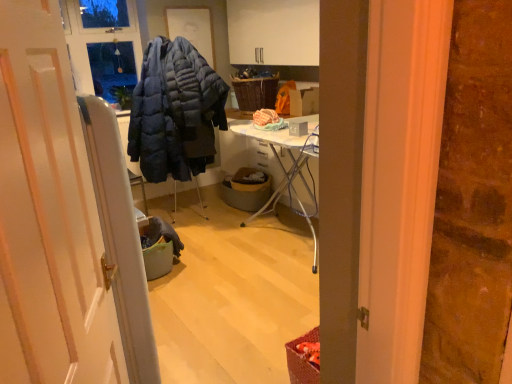
Question: Does white glossy door at center have a greater height compared to woven brown picnic basket at center?

Choices:
 (A) yes
 (B) no

Answer: (A)

Question: Does white glossy door at center appear on the right side of woven brown picnic basket at center?

Choices:
 (A) no
 (B) yes

Answer: (A)

Question: Is white glossy door at center thinner than woven brown picnic basket at center?

Choices:
 (A) yes
 (B) no

Answer: (A)

Question: Does white glossy door at center have a greater width compared to woven brown picnic basket at center?

Choices:
 (A) yes
 (B) no

Answer: (B)

Question: Considering the relative sizes of white glossy door at center and woven brown picnic basket at center in the image provided, is white glossy door at center smaller than woven brown picnic basket at center?

Choices:
 (A) yes
 (B) no

Answer: (B)

Question: From the image's perspective, is white glossy door at center positioned above or below woven brown picnic basket at center?

Choices:
 (A) above
 (B) below

Answer: (B)

Question: In the image, is white glossy door at center on the left side or the right side of woven brown picnic basket at center?

Choices:
 (A) left
 (B) right

Answer: (A)

Question: Is white glossy door at center taller or shorter than woven brown picnic basket at center?

Choices:
 (A) short
 (B) tall

Answer: (B)

Question: Is white glossy door at center inside the boundaries of woven brown picnic basket at center, or outside?

Choices:
 (A) outside
 (B) inside

Answer: (A)

Question: From a real-world perspective, is brown woven basket at center above or below woven brown picnic basket at center?

Choices:
 (A) below
 (B) above

Answer: (A)

Question: Based on their positions, is brown woven basket at center located to the left or right of woven brown picnic basket at center?

Choices:
 (A) right
 (B) left

Answer: (B)

Question: Choose the correct answer: Is brown woven basket at center inside woven brown picnic basket at center or outside it?

Choices:
 (A) inside
 (B) outside

Answer: (B)

Question: Considering the positions of brown woven basket at center and woven brown picnic basket at center in the image, is brown woven basket at center bigger or smaller than woven brown picnic basket at center?

Choices:
 (A) small
 (B) big

Answer: (A)

Question: From the image's perspective, is woven brown picnic basket at center above or below brown woven basket at center?

Choices:
 (A) above
 (B) below

Answer: (A)

Question: Would you say woven brown picnic basket at center is inside or outside brown woven basket at center?

Choices:
 (A) outside
 (B) inside

Answer: (A)